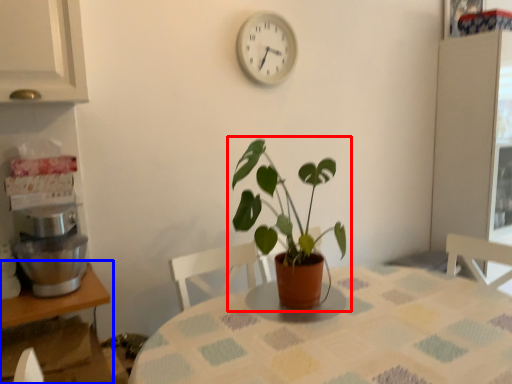
Question: Which object is further to the camera taking this photo, houseplant (highlighted by a red box) or table (highlighted by a blue box)?

Choices:
 (A) houseplant
 (B) table

Answer: (A)